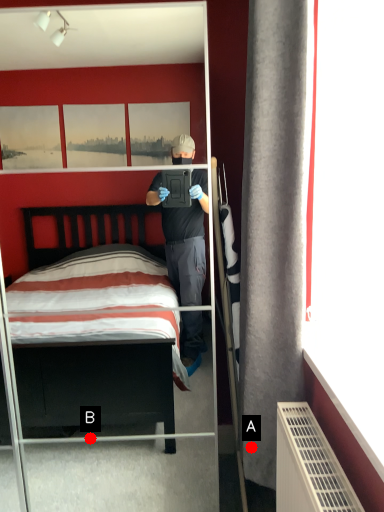
Question: Two points are circled on the image, labeled by A and B beside each circle. Which point is closer to the camera?

Choices:
 (A) A is closer
 (B) B is closer

Answer: (A)